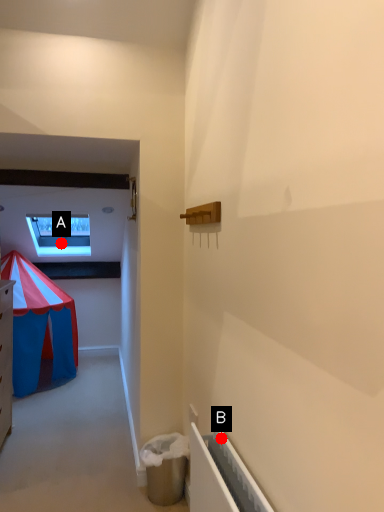
Question: Two points are circled on the image, labeled by A and B beside each circle. Which point is farther from the camera taking this photo?

Choices:
 (A) A is further
 (B) B is further

Answer: (A)